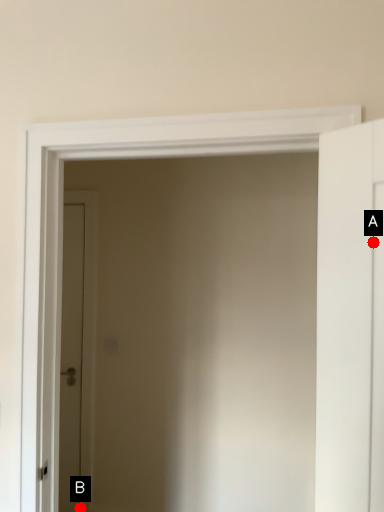
Question: Two points are circled on the image, labeled by A and B beside each circle. Which point is further to the camera?

Choices:
 (A) A is further
 (B) B is further

Answer: (B)